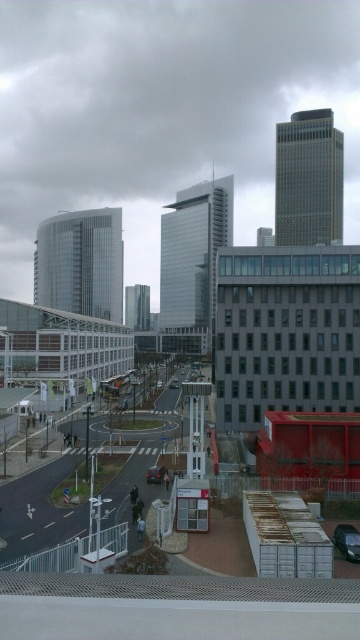
Can you confirm if shiny black car at lower right is positioned to the left of shiny black car at center?

No, shiny black car at lower right is not to the left of shiny black car at center.

How much distance is there between shiny black car at lower right and shiny black car at center?

shiny black car at lower right and shiny black car at center are 31.00 meters apart from each other.

This screenshot has width=360, height=640. In order to click on shiny black car at lower right in this screenshot , I will do `click(347, 541)`.